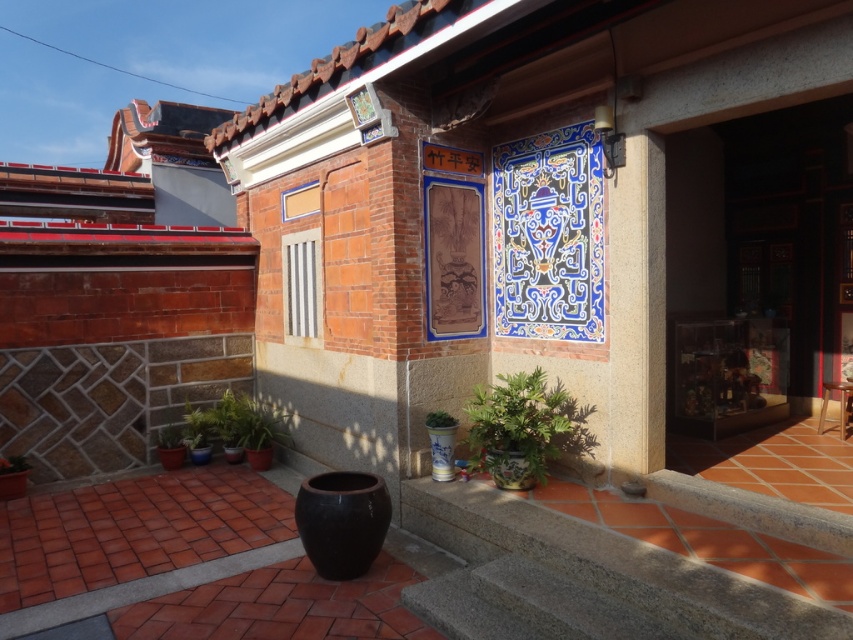
You are standing in front of the traditional building shown in the image. Where is the wooden door at center located in terms of coordinates?

The wooden door at center is located at coordinates point (757, 266).

You are a delivery person trying to deliver a package to the wooden door at center. However, you notice a green glossy plant at lower left blocking the path. Can you pass through the space next to the plant to reach the door?

The wooden door at center is wider than the green glossy plant at lower left, so yes, you can pass through the space next to the green glossy plant at lower left to reach the wooden door at center.